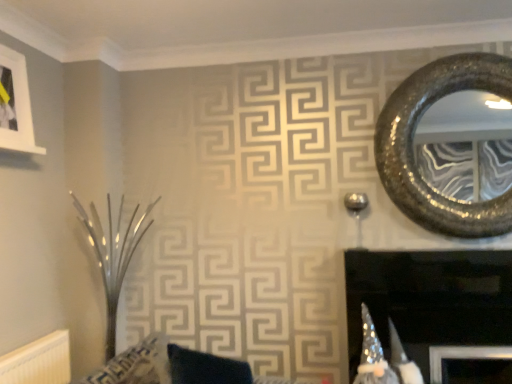
Question: From the image's perspective, is white matte picture frame at upper left above or below velvet dark blue cushion at center?

Choices:
 (A) below
 (B) above

Answer: (B)

Question: Is point (15, 145) positioned closer to the camera than point (249, 377)?

Choices:
 (A) closer
 (B) farther

Answer: (A)

Question: Which object is positioned closest to the white textured radiator at lower left?

Choices:
 (A) sparkly metallic mirror at upper right
 (B) velvet dark blue cushion at center
 (C) black glossy fireplace at center
 (D) white matte picture frame at upper left

Answer: (B)

Question: Considering the real-world distances, which object is closest to the white matte picture frame at upper left?

Choices:
 (A) black glossy fireplace at center
 (B) velvet dark blue cushion at center
 (C) white textured radiator at lower left
 (D) sparkly metallic mirror at upper right

Answer: (C)